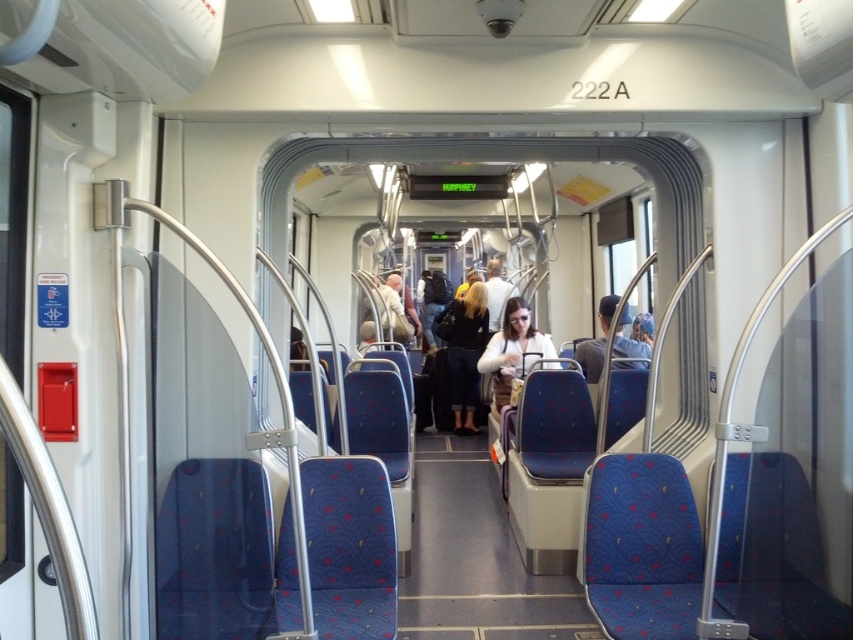
You are standing in the train carriage and want to determine the relative positions of two points marked in the scene. Which point is closer to you, point 1 at coordinates [466,378] or point 2 at coordinates [643,358]?

Point 1 at coordinates [466,378] is closer to you because it is further to the viewer than point 2 at coordinates [643,358].

You are a passenger on the train and need to reach your seat located at the back of the carriage. You see a dark blue fabric coat at center and a matte white jacket at center. Which item is blocking your path more towards the back?

The matte white jacket at center is behind the dark blue fabric coat at center, so the dark blue fabric coat at center is closer to your current position and thus blocking your path more towards the back.

You are standing in the train carriage of car 222A and want to reach the point at coordinates point (462, 428). If you can walk 3 feet per second, how many seconds will it take you to reach that point?

The point at coordinates point (462, 428) is 29.28 feet away from you. At a walking speed of 3 feet per second, it will take you 29.28 divided by 3 equals 9.76 seconds. So approximately 9.8 seconds.